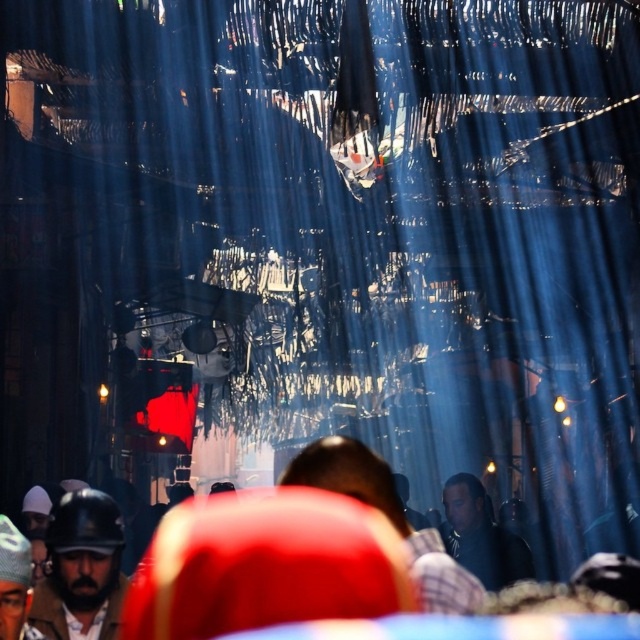
Question: Which object is the closest to the plaid shirt at center?

Choices:
 (A) dark blue shirt at center
 (B) red fabric headscarf at center

Answer: (B)

Question: Is plaid shirt at center behind dark blue shirt at center?

Choices:
 (A) no
 (B) yes

Answer: (A)

Question: Does matte black helmet at lower left appear on the left side of dark blue shirt at center?

Choices:
 (A) no
 (B) yes

Answer: (B)

Question: Does matte black helmet at lower left have a greater width compared to plaid shirt at center?

Choices:
 (A) yes
 (B) no

Answer: (B)

Question: Which of the following is the closest to the observer?

Choices:
 (A) plaid shirt at center
 (B) red fabric headscarf at center
 (C) dark blue shirt at center

Answer: (B)

Question: Estimate the real-world distances between objects in this image. Which object is farther from the red fabric headscarf at center?

Choices:
 (A) plaid shirt at center
 (B) dark blue shirt at center

Answer: (B)